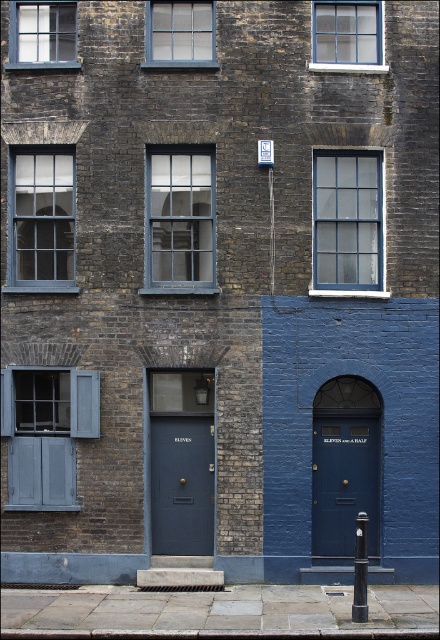
You are a painter who needs to decide which object to paint first between the blue glass window at center and the matte dark blue door at center. Since you want to paint the wider object first, which one should you start with?

The blue glass window at center is wider than the matte dark blue door at center, so you should start painting the blue glass window at center first.

You are standing in front of a brick building with two units. You see a matte blue door at center and a matte gray shutters at left. Which object is positioned to the left of the other?

The matte gray shutters at left are positioned to the left of the matte blue door at center.